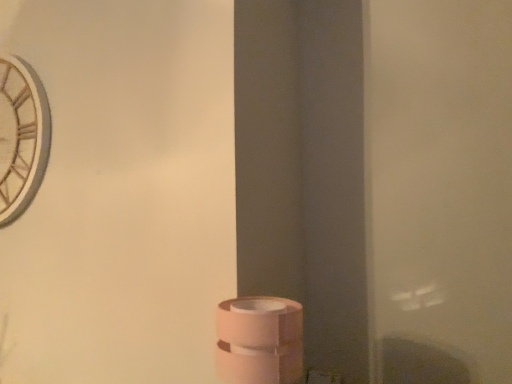
Question: Is pink matte toilet paper at lower center shorter than wooden clock at upper left?

Choices:
 (A) no
 (B) yes

Answer: (B)

Question: Is wooden clock at upper left a part of pink matte toilet paper at lower center?

Choices:
 (A) no
 (B) yes

Answer: (A)

Question: Is pink matte toilet paper at lower center facing away from wooden clock at upper left?

Choices:
 (A) yes
 (B) no

Answer: (B)

Question: From a real-world perspective, is pink matte toilet paper at lower center below wooden clock at upper left?

Choices:
 (A) no
 (B) yes

Answer: (B)

Question: From the image's perspective, would you say pink matte toilet paper at lower center is shown under wooden clock at upper left?

Choices:
 (A) no
 (B) yes

Answer: (B)

Question: Can you confirm if pink matte toilet paper at lower center is positioned to the left of wooden clock at upper left?

Choices:
 (A) yes
 (B) no

Answer: (B)

Question: Is pink matte toilet paper at lower center at the back of wooden clock at upper left?

Choices:
 (A) yes
 (B) no

Answer: (B)

Question: Does wooden clock at upper left come behind pink matte toilet paper at lower center?

Choices:
 (A) no
 (B) yes

Answer: (B)

Question: Considering the relative positions of wooden clock at upper left and pink matte toilet paper at lower center in the image provided, is wooden clock at upper left in front of pink matte toilet paper at lower center?

Choices:
 (A) no
 (B) yes

Answer: (A)

Question: Is wooden clock at upper left thinner than pink matte toilet paper at lower center?

Choices:
 (A) no
 (B) yes

Answer: (B)

Question: Considering the relative sizes of wooden clock at upper left and pink matte toilet paper at lower center in the image provided, is wooden clock at upper left wider than pink matte toilet paper at lower center?

Choices:
 (A) yes
 (B) no

Answer: (B)

Question: Is wooden clock at upper left aimed at pink matte toilet paper at lower center?

Choices:
 (A) no
 (B) yes

Answer: (A)

Question: Considering their positions, is wooden clock at upper left located in front of or behind pink matte toilet paper at lower center?

Choices:
 (A) behind
 (B) front

Answer: (A)